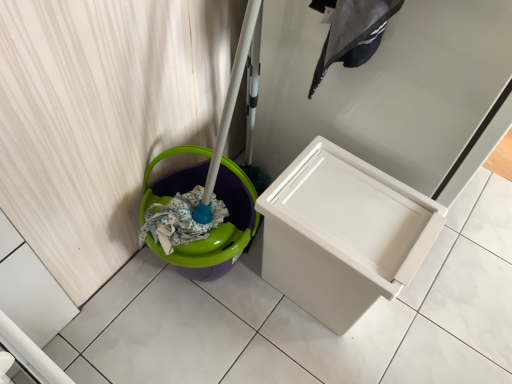
What do you see at coordinates (354, 34) in the screenshot? Image resolution: width=512 pixels, height=384 pixels. I see `dark gray fabric laundry at upper center` at bounding box center [354, 34].

You are a GUI agent. You are given a task and a screenshot of the screen. Output one action in this format:
    pyautogui.click(x=<x>, y=<y>)
    Task: Click on the white plastic drawer at center
    Image resolution: width=512 pixels, height=384 pixels.
    Given the screenshot: What is the action you would take?
    pyautogui.click(x=391, y=92)

What are the coordinates of `dark gray fabric laundry at upper center` in the screenshot? It's located at (354, 34).

The height and width of the screenshot is (384, 512). What are the coordinates of `waste container behind the white plastic drawer at center` in the screenshot? It's located at (343, 234).

From a real-world perspective, which object rests below the other?

white plastic waste container at center is physically lower.

Would you consider white plastic waste container at center to be distant from white plastic drawer at center?

No, there isn't a large distance between white plastic waste container at center and white plastic drawer at center.

Does white plastic waste container at center have a lesser width compared to white plastic drawer at center?

Yes.

Considering the relative positions of dark gray fabric laundry at upper center and white plastic waste container at center in the image provided, is dark gray fabric laundry at upper center to the left of white plastic waste container at center from the viewer's perspective?

Correct, you'll find dark gray fabric laundry at upper center to the left of white plastic waste container at center.

Looking at their sizes, would you say dark gray fabric laundry at upper center is wider or thinner than white plastic waste container at center?

dark gray fabric laundry at upper center is thinner than white plastic waste container at center.

From the image's perspective, who appears lower, dark gray fabric laundry at upper center or white plastic waste container at center?

white plastic waste container at center, from the image's perspective.

Does dark gray fabric laundry at upper center have a lesser height compared to white plastic drawer at center?

Correct, dark gray fabric laundry at upper center is not as tall as white plastic drawer at center.

Can you confirm if dark gray fabric laundry at upper center is positioned to the left of white plastic drawer at center?

Correct, you'll find dark gray fabric laundry at upper center to the left of white plastic drawer at center.

Which is behind, dark gray fabric laundry at upper center or white plastic drawer at center?

dark gray fabric laundry at upper center is further away from the camera.

Does point (365, 23) appear closer or farther from the camera than point (479, 130)?

Point (365, 23) is positioned closer to the camera compared to point (479, 130).

Do you think white plastic drawer at center is within white plastic waste container at center, or outside of it?

white plastic drawer at center is not inside white plastic waste container at center, it's outside.

Does white plastic drawer at center turn towards white plastic waste container at center?

No, white plastic drawer at center is not facing towards white plastic waste container at center.

From the image's perspective, between white plastic drawer at center and white plastic waste container at center, which one is located above?

white plastic drawer at center is shown above in the image.

Is white plastic drawer at center closer to the viewer compared to white plastic waste container at center?

That is True.

Do you think white plastic drawer at center is within dark gray fabric laundry at upper center, or outside of it?

The correct answer is: outside.

Between white plastic drawer at center and dark gray fabric laundry at upper center, which one is positioned behind?

dark gray fabric laundry at upper center is more distant.

From a real-world perspective, is white plastic drawer at center located beneath dark gray fabric laundry at upper center?

Yes.

Would you consider white plastic drawer at center to be distant from dark gray fabric laundry at upper center?

No, white plastic drawer at center is not far away from dark gray fabric laundry at upper center.

Is white plastic waste container at center facing away from dark gray fabric laundry at upper center?

white plastic waste container at center is not turned away from dark gray fabric laundry at upper center.

From a real-world perspective, is white plastic waste container at center on dark gray fabric laundry at upper center?

No, from a real-world perspective, white plastic waste container at center is not above dark gray fabric laundry at upper center.

Considering the sizes of objects white plastic waste container at center and dark gray fabric laundry at upper center in the image provided, who is smaller, white plastic waste container at center or dark gray fabric laundry at upper center?

dark gray fabric laundry at upper center.

The image size is (512, 384). In order to click on waste container behind the white plastic drawer at center in this screenshot , I will do `click(343, 234)`.

Find the location of a particular element. The width and height of the screenshot is (512, 384). laundry lying in front of the white plastic waste container at center is located at coordinates (354, 34).

From the image, which object appears to be farther from white plastic drawer at center, dark gray fabric laundry at upper center or white plastic waste container at center?

Among the two, white plastic waste container at center is located further to white plastic drawer at center.

Based on their spatial positions, is white plastic drawer at center or white plastic waste container at center closer to dark gray fabric laundry at upper center?

The object closer to dark gray fabric laundry at upper center is white plastic drawer at center.

From the image, which object appears to be farther from dark gray fabric laundry at upper center, white plastic waste container at center or white plastic drawer at center?

white plastic waste container at center lies further to dark gray fabric laundry at upper center than the other object.

Estimate the real-world distances between objects in this image. Which object is further from white plastic waste container at center, dark gray fabric laundry at upper center or white plastic drawer at center?

dark gray fabric laundry at upper center.

When comparing their distances from white plastic waste container at center, does white plastic drawer at center or dark gray fabric laundry at upper center seem closer?

The object closer to white plastic waste container at center is white plastic drawer at center.

From the image, which object appears to be nearer to white plastic drawer at center, white plastic waste container at center or dark gray fabric laundry at upper center?

Among the two, dark gray fabric laundry at upper center is located nearer to white plastic drawer at center.

The height and width of the screenshot is (384, 512). Find the location of `laundry between white plastic drawer at center and white plastic waste container at center from top to bottom`. laundry between white plastic drawer at center and white plastic waste container at center from top to bottom is located at coordinates (354, 34).